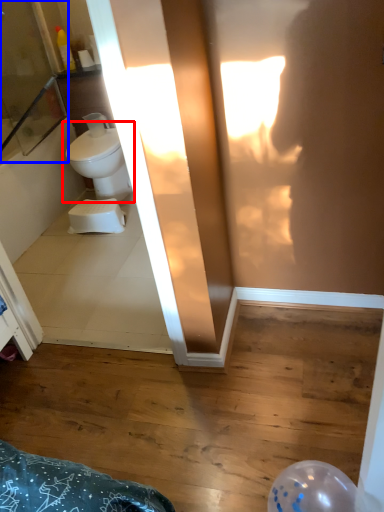
Question: Which object appears farthest to the camera in this image, toilet (highlighted by a red box) or screen door (highlighted by a blue box)?

Choices:
 (A) toilet
 (B) screen door

Answer: (A)